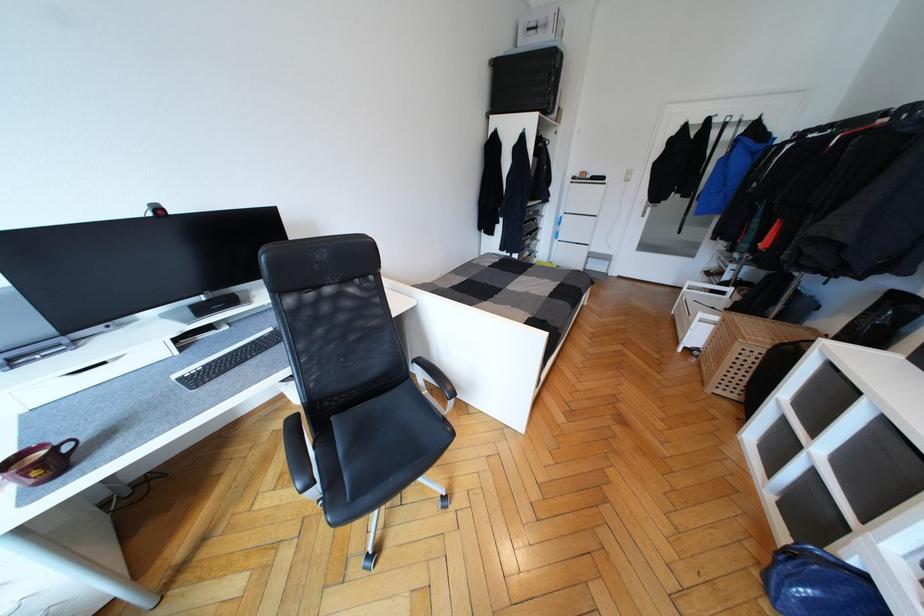
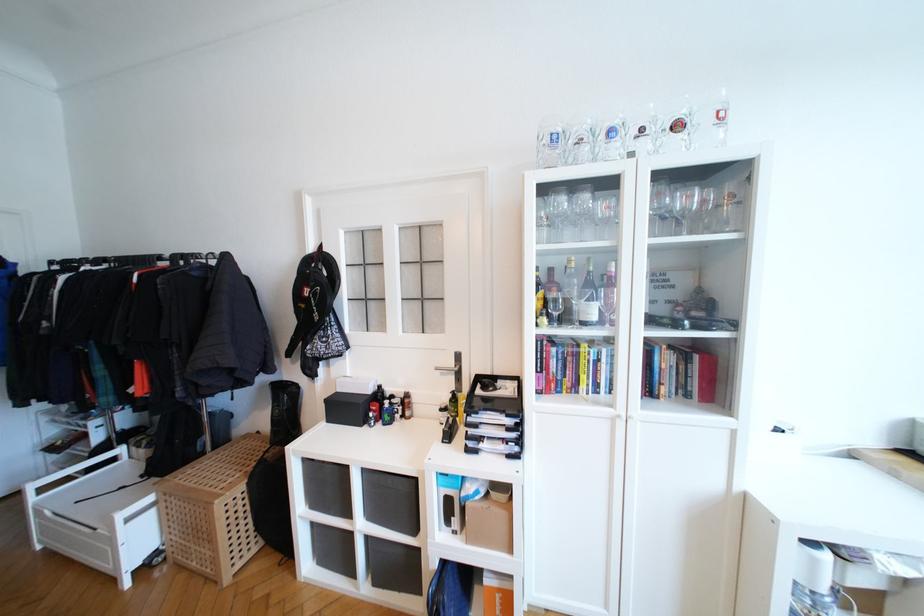
Where in the second image is the point corresponding to (734,390) from the first image?

(248, 551)